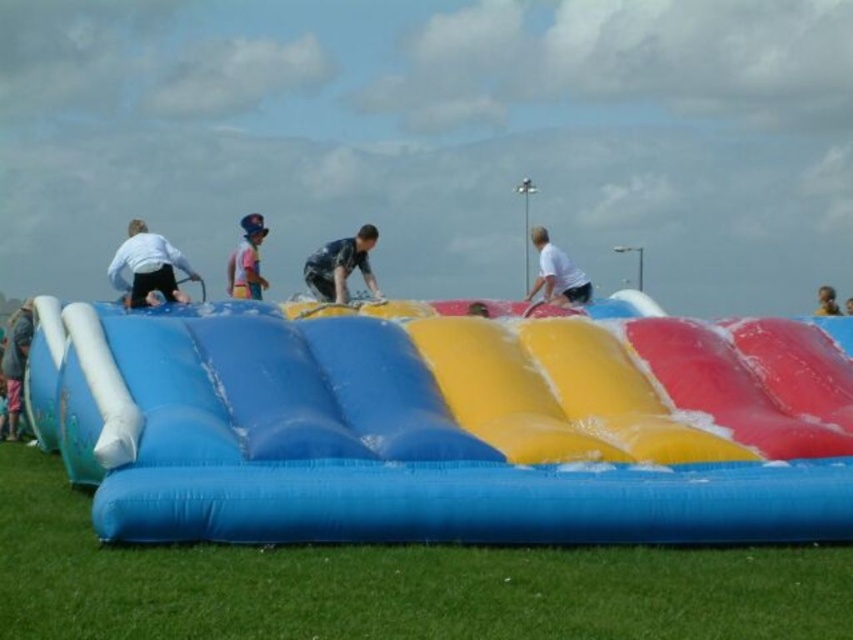
Question: Which object is farther from the camera taking this photo?

Choices:
 (A) smooth brown hair at upper right
 (B) matte white shorts at left

Answer: (A)

Question: Which object is closer to the camera taking this photo?

Choices:
 (A) green grass at lower center
 (B) dark blue fabric at center
 (C) pink fabric shirt at upper center

Answer: (A)

Question: In this image, where is green grass at lower center located relative to smooth yellow shirt at center?

Choices:
 (A) above
 (B) below

Answer: (B)

Question: Is the position of dark blue fabric at center more distant than that of white matte shirt at upper center?

Choices:
 (A) no
 (B) yes

Answer: (A)

Question: Estimate the real-world distances between objects in this image. Which object is farther from the matte blue inflatable at lower left?

Choices:
 (A) blue inflatable slide at center
 (B) matte white shorts at left

Answer: (A)

Question: Does pink fabric shirt at upper center have a lesser width compared to smooth brown hair at upper right?

Choices:
 (A) no
 (B) yes

Answer: (B)